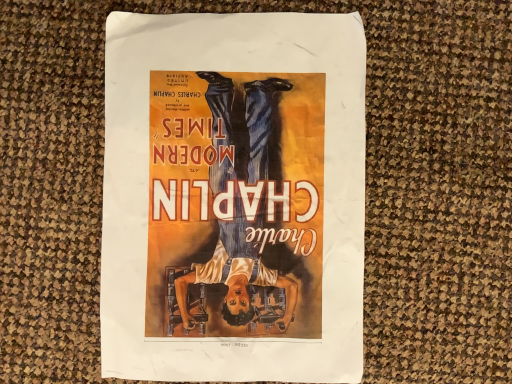
You are a GUI agent. You are given a task and a screenshot of the screen. Output one action in this format:
    pyautogui.click(x=<x>, y=<y>)
    Task: Click on the free space above matte paper poster at center (from a real-world perspective)
    
    Given the screenshot: What is the action you would take?
    pyautogui.click(x=230, y=197)